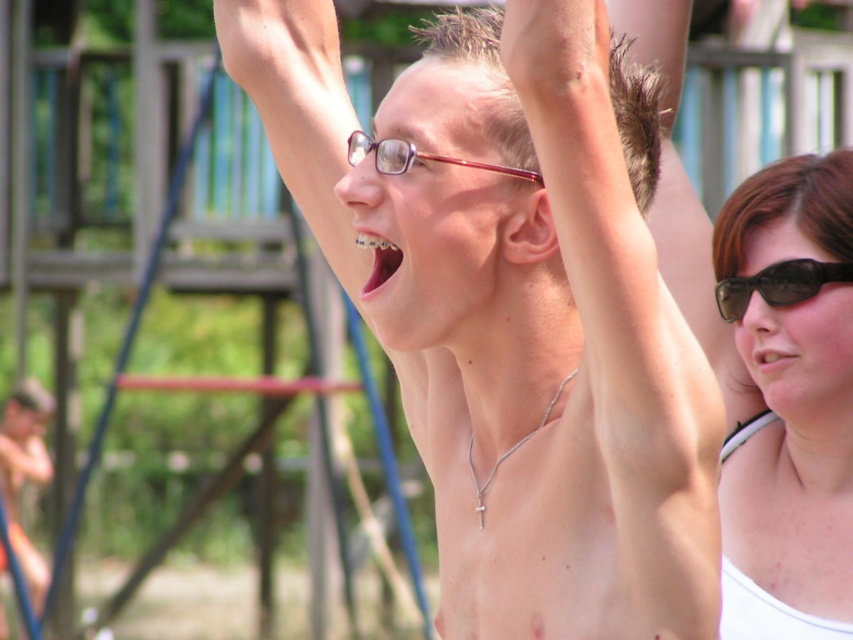
Question: Does skinny silver necklace at upper center appear over pink glossy teeth at center?

Choices:
 (A) yes
 (B) no

Answer: (B)

Question: Which of the following is the closest to the observer?

Choices:
 (A) white matte tank top at right
 (B) pink matte skin at center
 (C) skinny silver necklace at upper center
 (D) clear plastic glasses at center

Answer: (C)

Question: Which object is the farthest from the clear plastic glasses at center?

Choices:
 (A) pink matte skin at center
 (B) white matte tank top at right
 (C) shiny skin at center

Answer: (A)

Question: Can you confirm if shiny skin at center is wider than clear plastic glasses at center?

Choices:
 (A) yes
 (B) no

Answer: (A)

Question: Does shiny skin at center lie behind pink glossy teeth at center?

Choices:
 (A) yes
 (B) no

Answer: (B)

Question: Which point is farther to the camera?

Choices:
 (A) pink matte skin at center
 (B) pink glossy teeth at center
 (C) black plastic sunglasses at upper right
 (D) skinny silver necklace at upper center

Answer: (A)